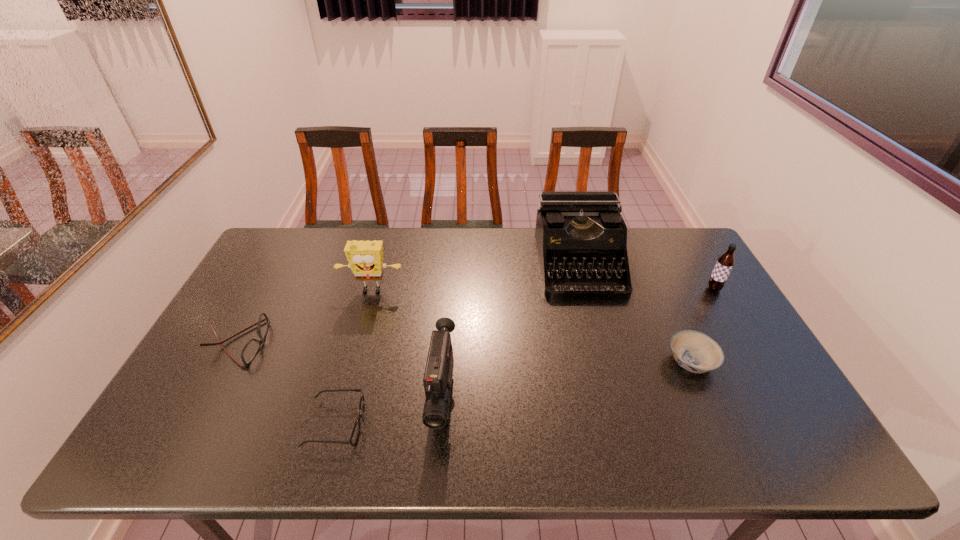
The width and height of the screenshot is (960, 540). What are the coordinates of `the fifth object from left to right` in the screenshot? It's located at (583, 231).

Identify the location of sponge. pos(365,258).

The image size is (960, 540). I want to click on the rightmost object, so click(725, 263).

This screenshot has height=540, width=960. Identify the location of camcorder. (437, 380).

You are a GUI agent. You are given a task and a screenshot of the screen. Output one action in this format:
    pyautogui.click(x=<x>, y=<y>)
    Task: Click on the second object from right to left
    The width and height of the screenshot is (960, 540).
    Given the screenshot: What is the action you would take?
    pyautogui.click(x=696, y=352)

Where is `the left spectacles`? The image size is (960, 540). the left spectacles is located at coordinates (250, 350).

The width and height of the screenshot is (960, 540). Identify the location of the leftmost object. (250, 350).

The image size is (960, 540). In order to click on the nearer spectacles in this screenshot , I will do `click(355, 433)`.

The image size is (960, 540). What are the coordinates of `blank area located 0.120m on the typing side of the typewriter` in the screenshot? It's located at (595, 329).

Locate an element on the screen. The image size is (960, 540). free space located on the front-facing side of the sponge is located at coordinates (345, 391).